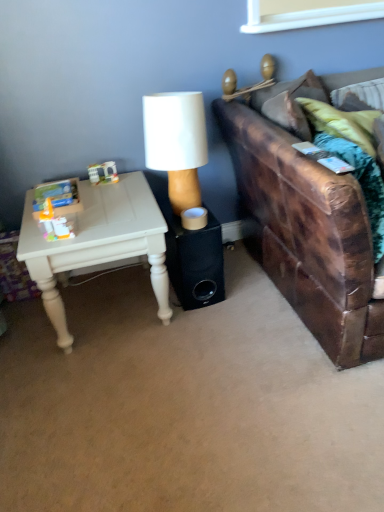
Question: Can brown leather couch at right be found inside white painted wood table at left?

Choices:
 (A) no
 (B) yes

Answer: (A)

Question: Is white painted wood table at left wider than brown leather couch at right?

Choices:
 (A) no
 (B) yes

Answer: (A)

Question: Is white painted wood table at left not within brown leather couch at right?

Choices:
 (A) yes
 (B) no

Answer: (A)

Question: Does white painted wood table at left lie behind brown leather couch at right?

Choices:
 (A) yes
 (B) no

Answer: (A)

Question: From the image's perspective, is white painted wood table at left under brown leather couch at right?

Choices:
 (A) no
 (B) yes

Answer: (B)

Question: Is brown leather couch at right situated inside white painted wood table at left or outside?

Choices:
 (A) outside
 (B) inside

Answer: (A)

Question: Considering the positions of point (248, 183) and point (124, 258), is point (248, 183) closer or farther from the camera than point (124, 258)?

Choices:
 (A) closer
 (B) farther

Answer: (B)

Question: In terms of width, does brown leather couch at right look wider or thinner when compared to white painted wood table at left?

Choices:
 (A) wide
 (B) thin

Answer: (A)

Question: From the image's perspective, is brown leather couch at right located above or below white painted wood table at left?

Choices:
 (A) below
 (B) above

Answer: (B)

Question: From a real-world perspective, relative to black matte speaker at center, is white matte lamp at center vertically above or below?

Choices:
 (A) above
 (B) below

Answer: (A)

Question: From the image's perspective, is white matte lamp at center positioned above or below black matte speaker at center?

Choices:
 (A) above
 (B) below

Answer: (A)

Question: Is white matte lamp at center bigger or smaller than black matte speaker at center?

Choices:
 (A) small
 (B) big

Answer: (B)

Question: Is white matte lamp at center in front of or behind black matte speaker at center in the image?

Choices:
 (A) front
 (B) behind

Answer: (A)

Question: From the image's perspective, is white painted wood table at left above or below brown leather couch at right?

Choices:
 (A) above
 (B) below

Answer: (B)

Question: From a real-world perspective, is white painted wood table at left above or below brown leather couch at right?

Choices:
 (A) below
 (B) above

Answer: (A)